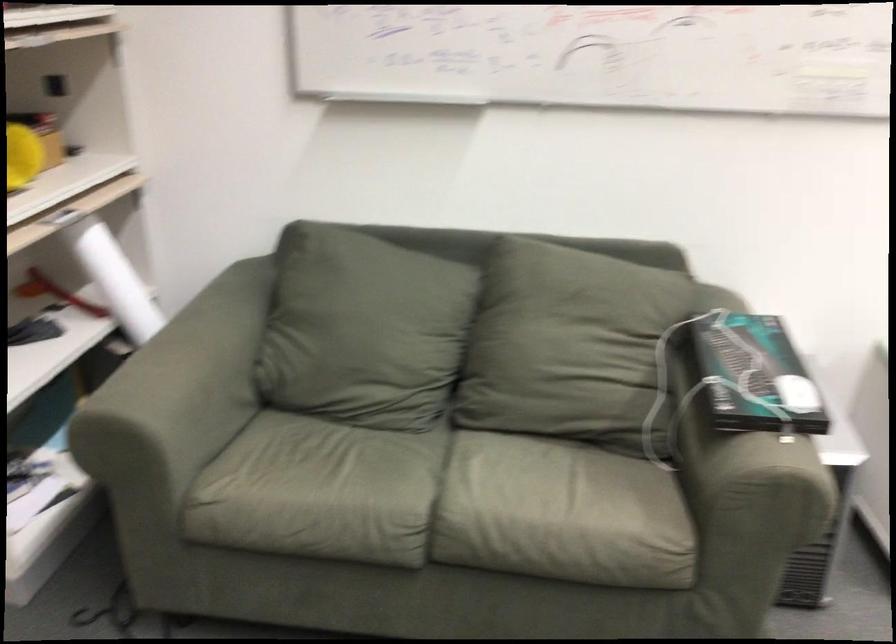
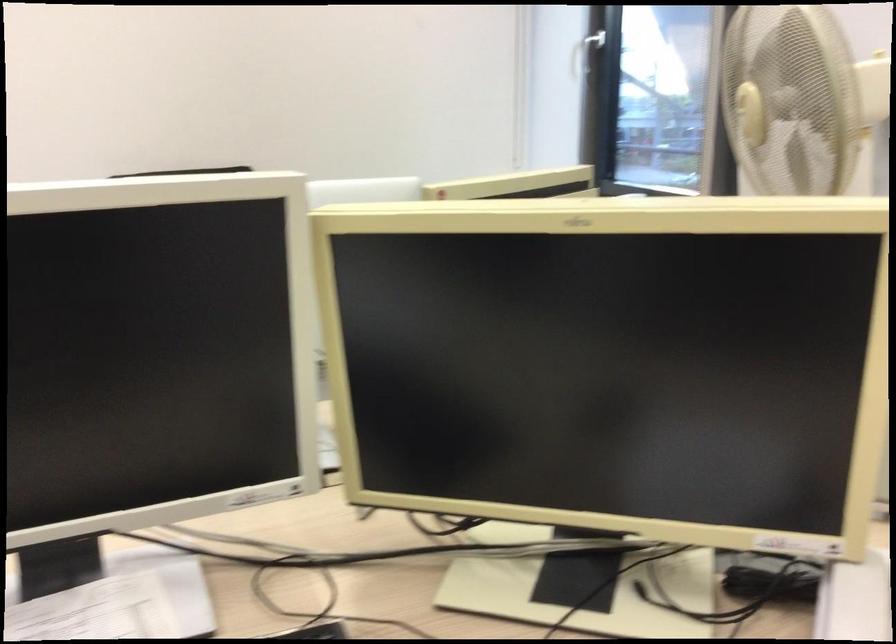
Which direction would the cameraman need to move to produce the second image?

The cameraman moved toward right, backward.